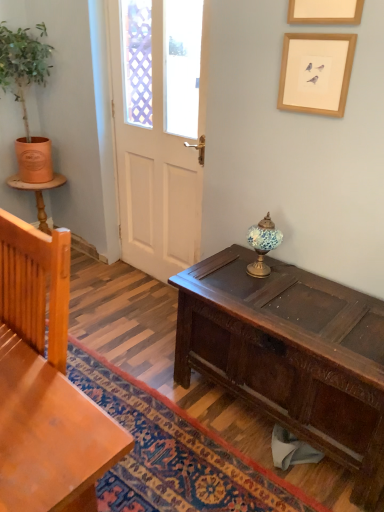
Question: Visually, is orange clay pot at left positioned to the left or to the right of light brown wood chair at left?

Choices:
 (A) left
 (B) right

Answer: (A)

Question: From the image's perspective, relative to light brown wood chair at left, is orange clay pot at left above or below?

Choices:
 (A) below
 (B) above

Answer: (B)

Question: Which of these objects is positioned farthest from the white matte door at center?

Choices:
 (A) light brown wood chair at left
 (B) wooden picture frame at upper right, which appears as the first picture frame when ordered from the bottom
 (C) orange clay pot at left
 (D) dark brown wood desk at center
 (E) white matte picture frame at upper center, the first picture frame positioned from the top

Answer: (A)

Question: Which of these objects is positioned closest to the wooden picture frame at upper right, the 2th picture frame from the top?

Choices:
 (A) white matte picture frame at upper center, the first picture frame positioned from the top
 (B) orange clay pot at left
 (C) light brown wood chair at left
 (D) white matte door at center
 (E) dark brown wood desk at center

Answer: (A)